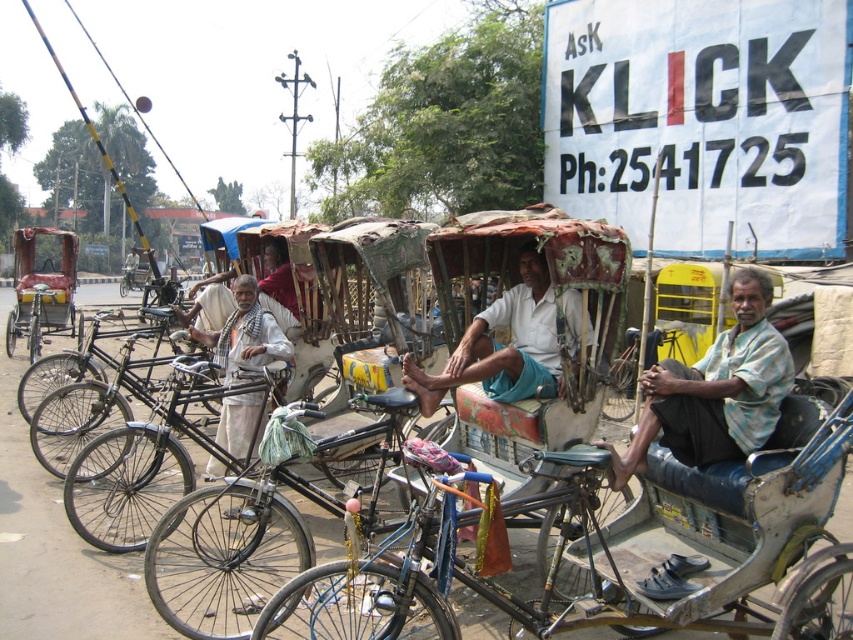
You are a customer waiting at the roadside and see a light blue shirt at center and a white cotton scarf at center. Which item is positioned higher on the person wearing them?

The light blue shirt at center is located above the white cotton scarf at center, so the light blue shirt at center is positioned higher on the person wearing them.